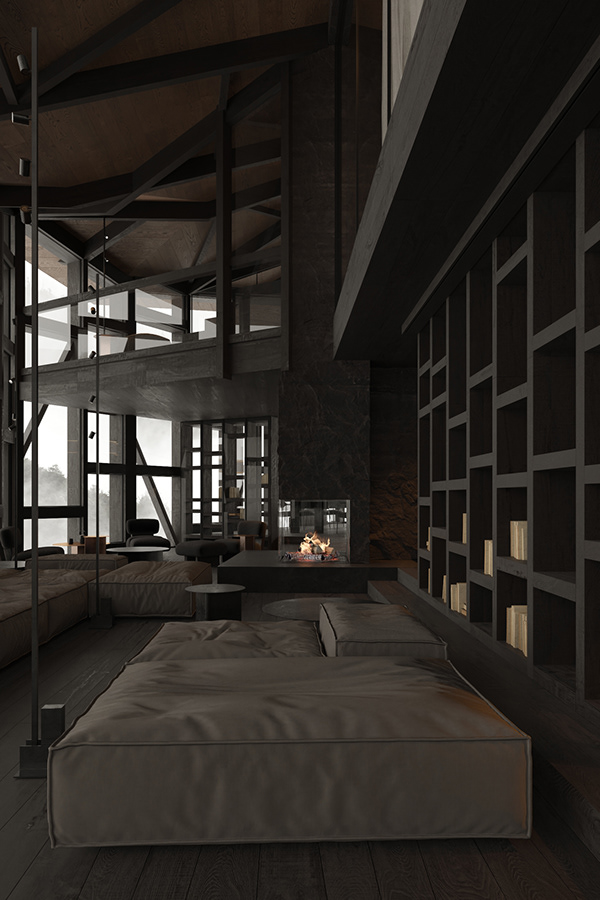
You are a GUI agent. You are given a task and a screenshot of the screen. Output one action in this format:
    pyautogui.click(x=<x>, y=<y>)
    Task: Click on the small black chairs
    The image size is (600, 900).
    Given the screenshot: What is the action you would take?
    pyautogui.click(x=199, y=549), pyautogui.click(x=151, y=540), pyautogui.click(x=256, y=528), pyautogui.click(x=21, y=554)